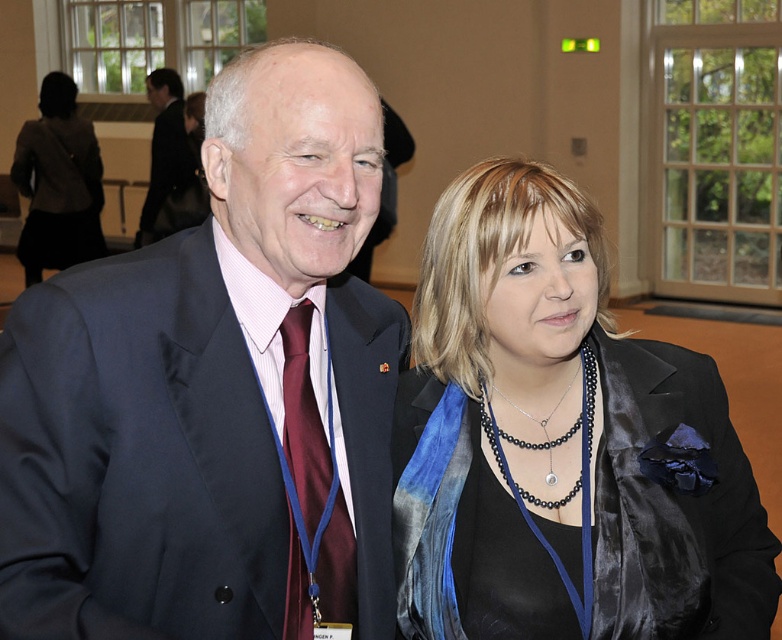
Is point (49, 129) more distant than point (289, 364)?

Yes, it is.

Which is above, dark gray blazer at left or maroon satin tie at center?

dark gray blazer at left is above.

Describe the element at coordinates (56, 182) in the screenshot. This screenshot has height=640, width=782. I see `dark gray blazer at left` at that location.

Image resolution: width=782 pixels, height=640 pixels. Find the location of `dark gray blazer at left`. dark gray blazer at left is located at coordinates (56, 182).

Is satin dark blue suit at center to the left of dark gray blazer at left from the viewer's perspective?

In fact, satin dark blue suit at center is to the right of dark gray blazer at left.

The width and height of the screenshot is (782, 640). What do you see at coordinates (214, 392) in the screenshot? I see `satin dark blue suit at center` at bounding box center [214, 392].

Locate an element on the screen. This screenshot has height=640, width=782. satin dark blue suit at center is located at coordinates (214, 392).

What do you see at coordinates (214, 392) in the screenshot? I see `satin dark blue suit at center` at bounding box center [214, 392].

Is point (178, 304) behind point (334, 595)?

No, (178, 304) is closer to viewer.

Between point (20, 298) and point (311, 486), which one is positioned behind?

The point (311, 486) is more distant.

Where is `satin dark blue suit at center`? satin dark blue suit at center is located at coordinates (214, 392).